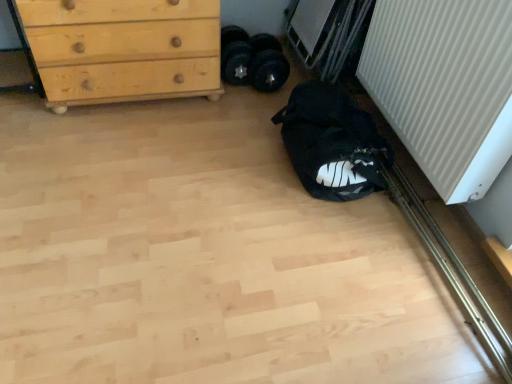
Question: Is black fabric bag at lower right completely or partially outside of light wood/texture chest of drawers at upper left?

Choices:
 (A) yes
 (B) no

Answer: (A)

Question: Is light wood/texture chest of drawers at upper left completely or partially inside black fabric bag at lower right?

Choices:
 (A) yes
 (B) no

Answer: (B)

Question: Considering the relative sizes of black fabric bag at lower right and light wood/texture chest of drawers at upper left in the image provided, is black fabric bag at lower right shorter than light wood/texture chest of drawers at upper left?

Choices:
 (A) no
 (B) yes

Answer: (B)

Question: Considering the relative sizes of black fabric bag at lower right and light wood/texture chest of drawers at upper left in the image provided, is black fabric bag at lower right bigger than light wood/texture chest of drawers at upper left?

Choices:
 (A) no
 (B) yes

Answer: (A)

Question: Considering the relative sizes of black fabric bag at lower right and light wood/texture chest of drawers at upper left in the image provided, is black fabric bag at lower right thinner than light wood/texture chest of drawers at upper left?

Choices:
 (A) no
 (B) yes

Answer: (A)

Question: Choose the correct answer: Is light wood/texture chest of drawers at upper left inside black fabric bag at lower right or outside it?

Choices:
 (A) inside
 (B) outside

Answer: (B)

Question: Looking at the image, does light wood/texture chest of drawers at upper left seem bigger or smaller compared to black fabric bag at lower right?

Choices:
 (A) big
 (B) small

Answer: (A)

Question: In the image, is light wood/texture chest of drawers at upper left on the left side or the right side of black fabric bag at lower right?

Choices:
 (A) right
 (B) left

Answer: (B)

Question: Considering their positions, is light wood/texture chest of drawers at upper left located in front of or behind black fabric bag at lower right?

Choices:
 (A) front
 (B) behind

Answer: (B)

Question: From the image's perspective, relative to black fabric bag at lower right, is white ribbed radiator at right above or below?

Choices:
 (A) below
 (B) above

Answer: (B)

Question: Is white ribbed radiator at right inside the boundaries of black fabric bag at lower right, or outside?

Choices:
 (A) outside
 (B) inside

Answer: (A)

Question: Looking at their shapes, would you say white ribbed radiator at right is wider or thinner than black fabric bag at lower right?

Choices:
 (A) thin
 (B) wide

Answer: (A)

Question: From a real-world perspective, is white ribbed radiator at right above or below black fabric bag at lower right?

Choices:
 (A) above
 (B) below

Answer: (A)

Question: Considering the positions of light wood/texture chest of drawers at upper left and white ribbed radiator at right in the image, is light wood/texture chest of drawers at upper left wider or thinner than white ribbed radiator at right?

Choices:
 (A) wide
 (B) thin

Answer: (A)

Question: From a real-world perspective, is light wood/texture chest of drawers at upper left positioned above or below white ribbed radiator at right?

Choices:
 (A) above
 (B) below

Answer: (B)